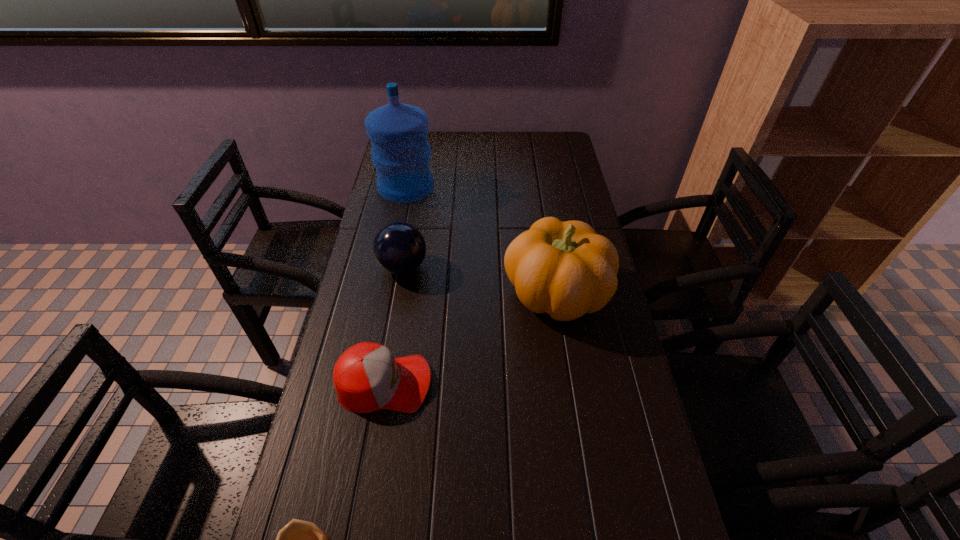
This screenshot has width=960, height=540. Identify the location of water jug. (401, 154).

Locate an element on the screen. the tallest object is located at coordinates (401, 154).

Where is `the rightmost object`? This screenshot has width=960, height=540. the rightmost object is located at coordinates (565, 269).

The image size is (960, 540). I want to click on the second tallest object, so click(x=565, y=269).

Where is `bowling ball`? This screenshot has width=960, height=540. bowling ball is located at coordinates (399, 248).

In order to click on baseball cap in this screenshot , I will do `click(367, 377)`.

Find the location of a particular element. the shortest object is located at coordinates (367, 377).

Identify the location of free space located 0.350m on the right of the farthest object. (530, 187).

Find the location of a particular element. This screenshot has width=960, height=540. blank area located on the front of the fourth shortest object is located at coordinates (568, 369).

Find the location of a particular element. free space located 0.340m on the surface of the third tallest object near the finger holes is located at coordinates (541, 267).